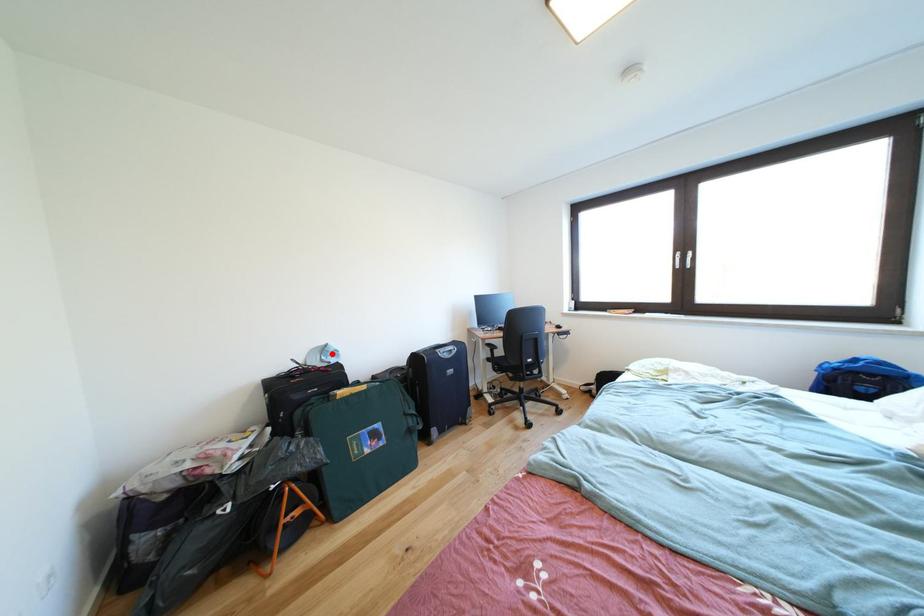
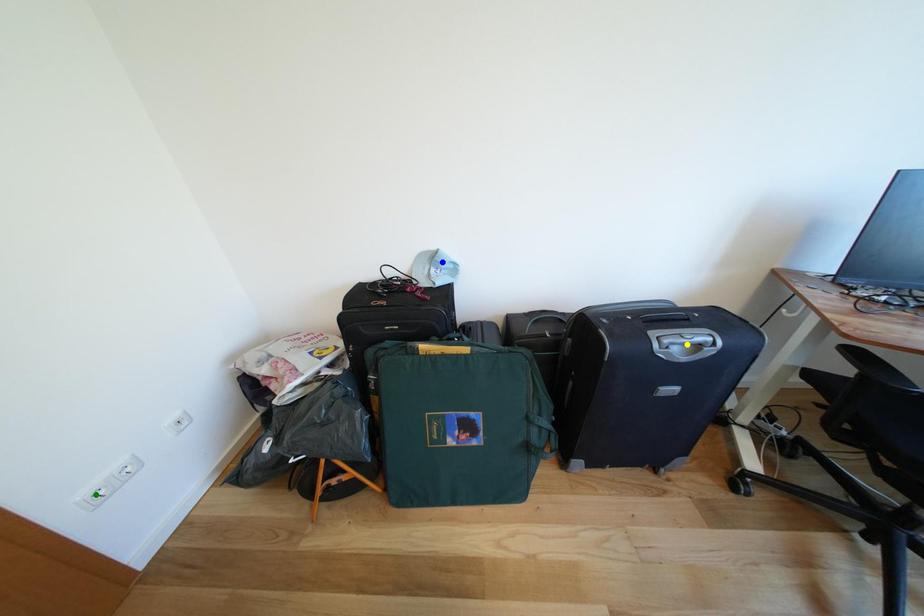
Question: I am providing you with two images of the same scene from different viewpoints. A red point is marked on the first image. You are given multiple points on the second image. Can you choose the point in image 2 that corresponds to the point in image 1?

Choices:
 (A) yellow point
 (B) blue point
 (C) green point

Answer: (B)